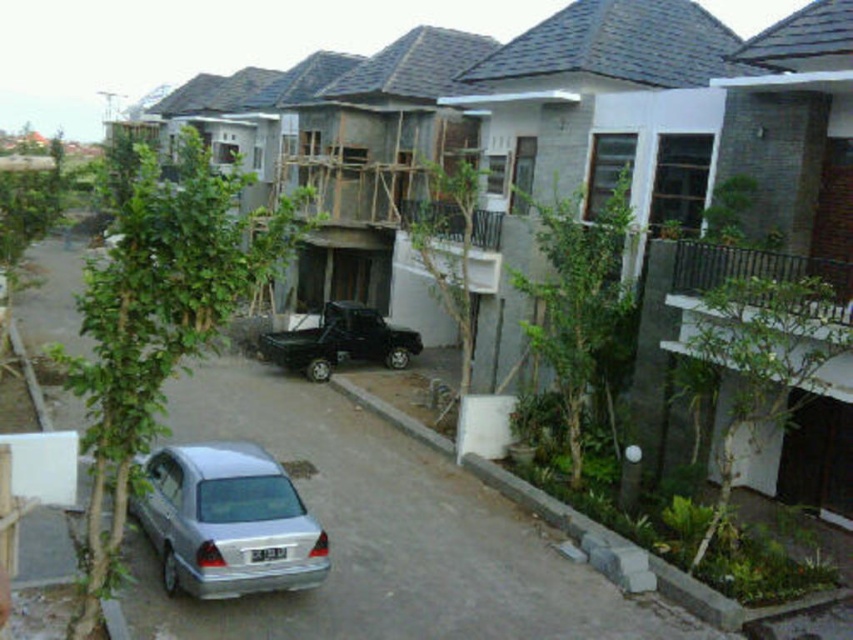
Question: Among these objects, which one is farthest from the camera?

Choices:
 (A) black matte truck at center
 (B) silver metallic car at lower left

Answer: (A)

Question: Which point is closer to the camera?

Choices:
 (A) black matte truck at center
 (B) metallic silver car at center

Answer: (B)

Question: Can you confirm if silver metallic car at lower left is bigger than black matte truck at center?

Choices:
 (A) yes
 (B) no

Answer: (B)

Question: Considering the relative positions of metallic silver car at center and silver metallic car at lower left in the image provided, where is metallic silver car at center located with respect to silver metallic car at lower left?

Choices:
 (A) right
 (B) left

Answer: (B)

Question: Which object appears closest to the camera in this image?

Choices:
 (A) silver metallic car at lower left
 (B) black matte truck at center

Answer: (A)

Question: Does metallic silver car at center come in front of black matte truck at center?

Choices:
 (A) yes
 (B) no

Answer: (A)